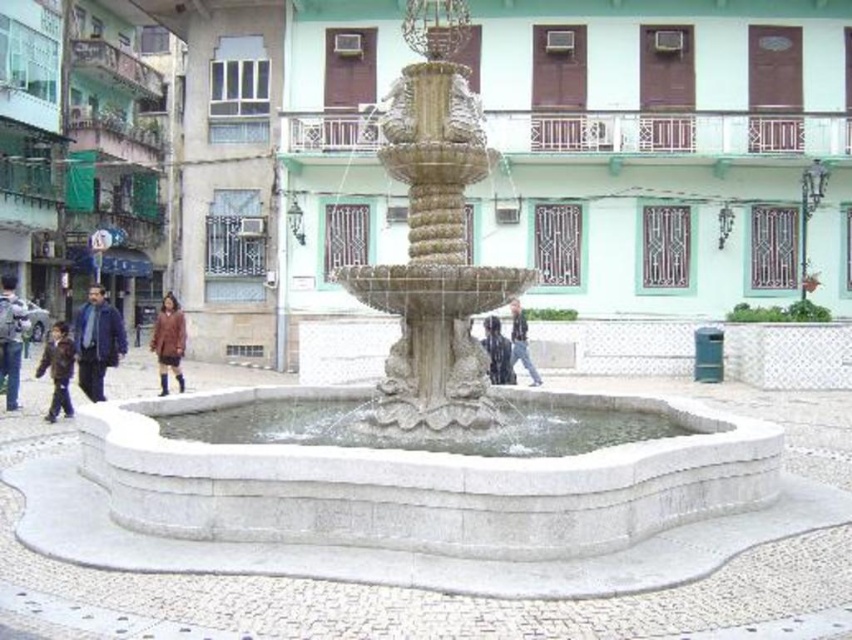
From the picture: Can you confirm if dark blue jeans at center is smaller than dark brown leather jacket at center?

Yes.

Between dark blue jeans at center and dark brown leather jacket at center, which one appears on the right side from the viewer's perspective?

From the viewer's perspective, dark brown leather jacket at center appears more on the right side.

What do you see at coordinates (498, 352) in the screenshot? I see `dark blue jeans at center` at bounding box center [498, 352].

At what (x,y) coordinates should I click in order to perform the action: click on dark blue jeans at center. Please return your answer as a coordinate pair (x, y). This screenshot has width=852, height=640. Looking at the image, I should click on (498, 352).

Is dark blue jacket at left positioned at the back of brown leather jacket at lower left?

Yes.

Which is behind, point (117, 355) or point (53, 392)?

The point (117, 355) is more distant.

Does point (79, 321) come in front of point (50, 403)?

Yes.

Locate an element on the screen. The width and height of the screenshot is (852, 640). dark blue jacket at left is located at coordinates tap(96, 340).

You are a GUI agent. You are given a task and a screenshot of the screen. Output one action in this format:
    pyautogui.click(x=<x>, y=<y>)
    Task: Click on the brown leather coat at lower left
    The width and height of the screenshot is (852, 640).
    Given the screenshot: What is the action you would take?
    pyautogui.click(x=168, y=340)

Is brown leather coat at lower left positioned behind dark blue jeans at center?

Yes, it is behind dark blue jeans at center.

Image resolution: width=852 pixels, height=640 pixels. Describe the element at coordinates (168, 340) in the screenshot. I see `brown leather coat at lower left` at that location.

Find the location of a particular element. The height and width of the screenshot is (640, 852). brown leather coat at lower left is located at coordinates (168, 340).